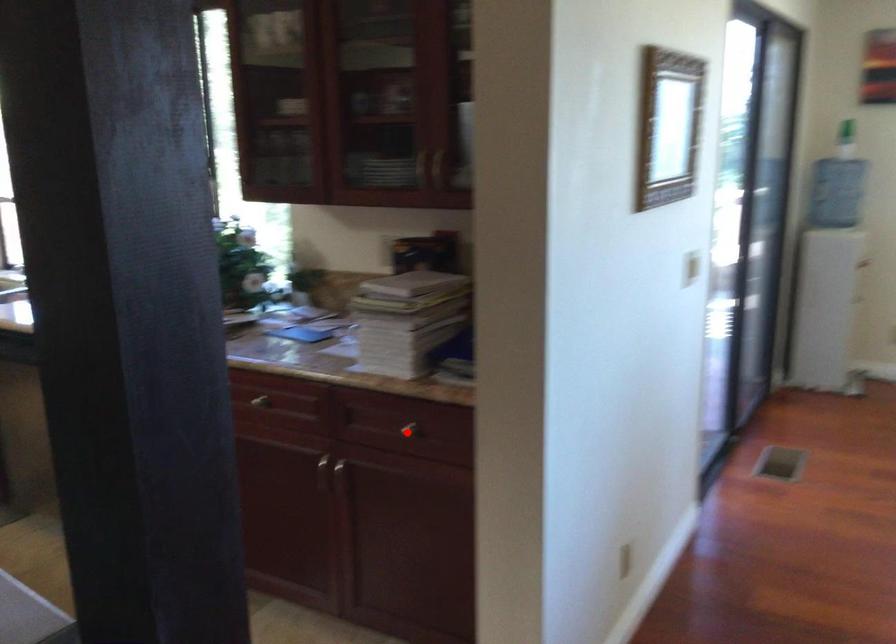
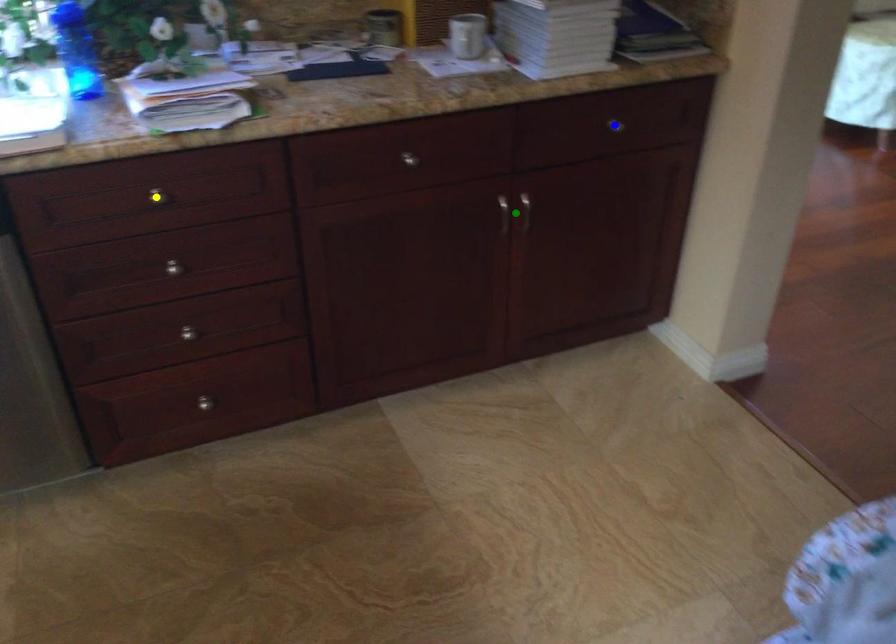
Question: I am providing you with two images of the same scene from different viewpoints. A red point is marked on the first image. You are given multiple points on the second image. Which mark in image 2 goes with the point in image 1?

Choices:
 (A) green point
 (B) blue point
 (C) yellow point

Answer: (B)